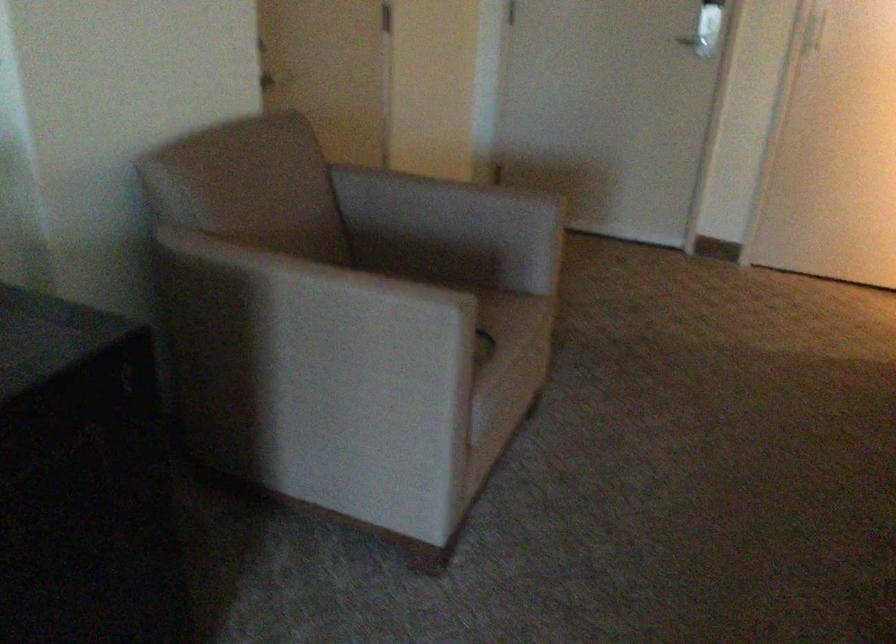
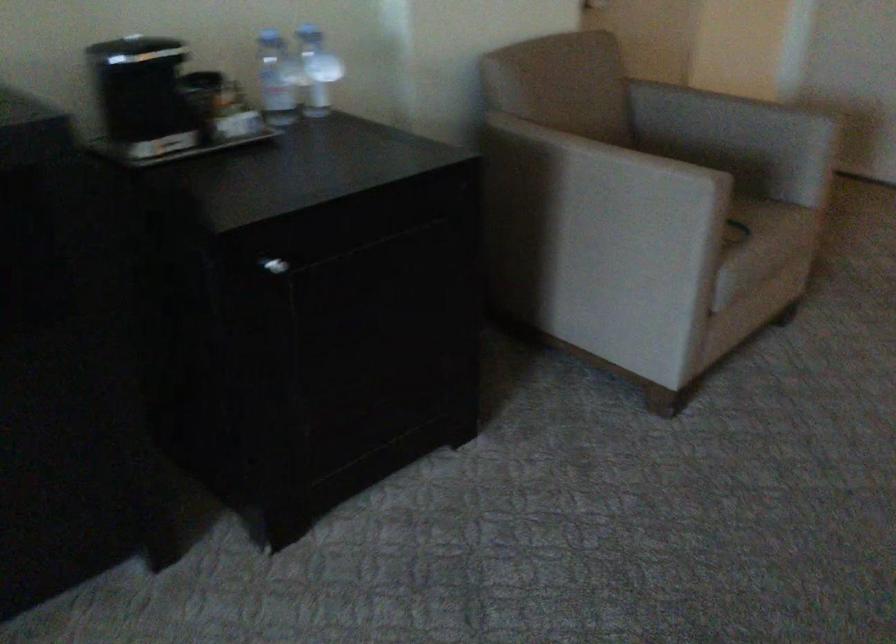
Consider the image. The images are taken continuously from a first-person perspective. In which direction are you moving?

The cameraman walked toward right, backward.